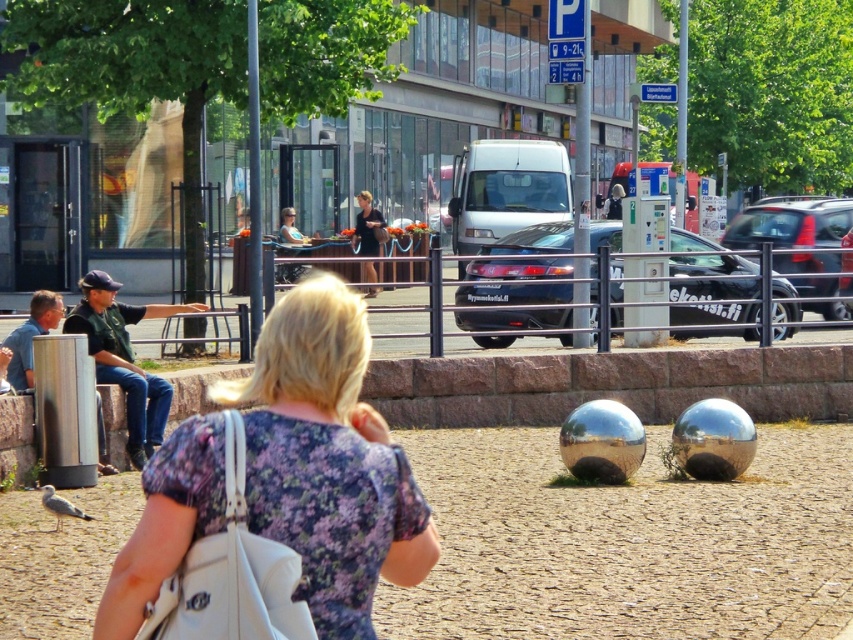
You are a delivery person standing at the camera position. You need to deliver a package to the black glossy car at center. The delivery robot you have can move up to 25 meters. Can the robot reach the car?

The black glossy car at center is 20.22 meters away from camera. Since the robot can move up to 25 meters, it can reach the car.

You are a photographer trying to capture a candid shot of both the floral fabric dress at center and the jeans at left. Since you can only focus on one subject at a time, which one should you aim for to ensure the other is still in the frame?

The floral fabric dress at center is to the right of jeans at left, so focusing on the jeans at left would keep the floral fabric dress at center within the frame.